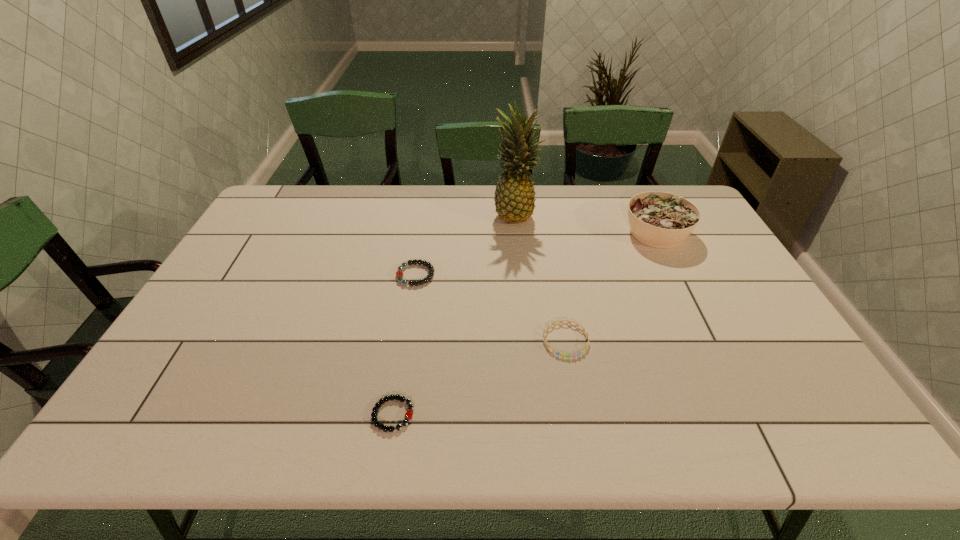
Where is `empty space between the third farthest object and the rightmost bracelet`? This screenshot has height=540, width=960. empty space between the third farthest object and the rightmost bracelet is located at coordinates (491, 308).

Find the location of `free space between the farthest bracelet and the nearest object`. free space between the farthest bracelet and the nearest object is located at coordinates (404, 345).

Find the location of a particular element. The image size is (960, 540). object that is the nearest to the third farthest object is located at coordinates (514, 198).

Locate an element on the screen. object that stands as the closest to the rightmost object is located at coordinates (514, 198).

Locate which bracelet ranks in proximity to the second farthest bracelet. Please provide its 2D coordinates. Your answer should be formatted as a tuple, i.e. [(x, y)], where the tuple contains the x and y coordinates of a point satisfying the conditions above.

[(408, 415)]

This screenshot has width=960, height=540. I want to click on bracelet identified as the third closest to the rightmost object, so click(x=408, y=415).